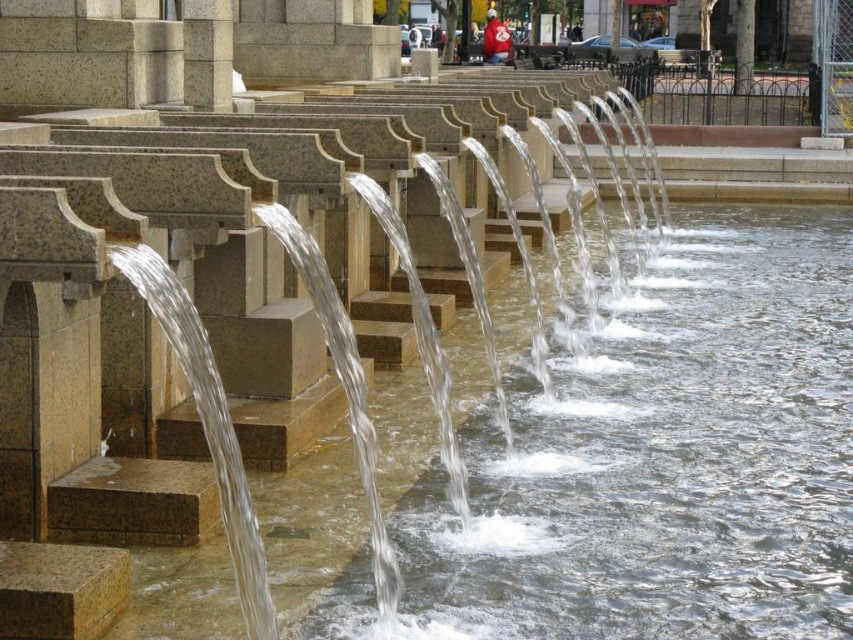
Question: Among these points, which one is farthest from the camera?

Choices:
 (A) (228, 33)
 (B) (519, 632)

Answer: (A)

Question: Which of the following is the closest to the observer?

Choices:
 (A) clear water at center
 (B) granite pillar at center

Answer: (A)

Question: Is clear water at center to the left of granite pillar at center from the viewer's perspective?

Choices:
 (A) no
 (B) yes

Answer: (A)

Question: Is clear water at center above granite pillar at center?

Choices:
 (A) yes
 (B) no

Answer: (B)

Question: Among these objects, which one is nearest to the camera?

Choices:
 (A) granite pillar at center
 (B) clear water at center

Answer: (B)

Question: Is clear water at center smaller than granite pillar at center?

Choices:
 (A) yes
 (B) no

Answer: (B)